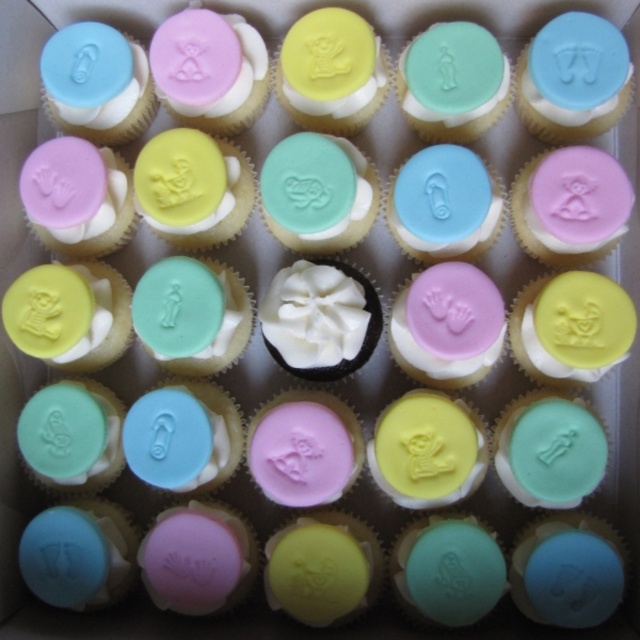
Who is higher up, blue matte flip-flop at upper right or white fluffy frosting at center?

blue matte flip-flop at upper right

Is blue matte flip-flop at upper right positioned in front of white fluffy frosting at center?

No, it is not.

Identify the location of blue matte flip-flop at upper right. The width and height of the screenshot is (640, 640). (572, 77).